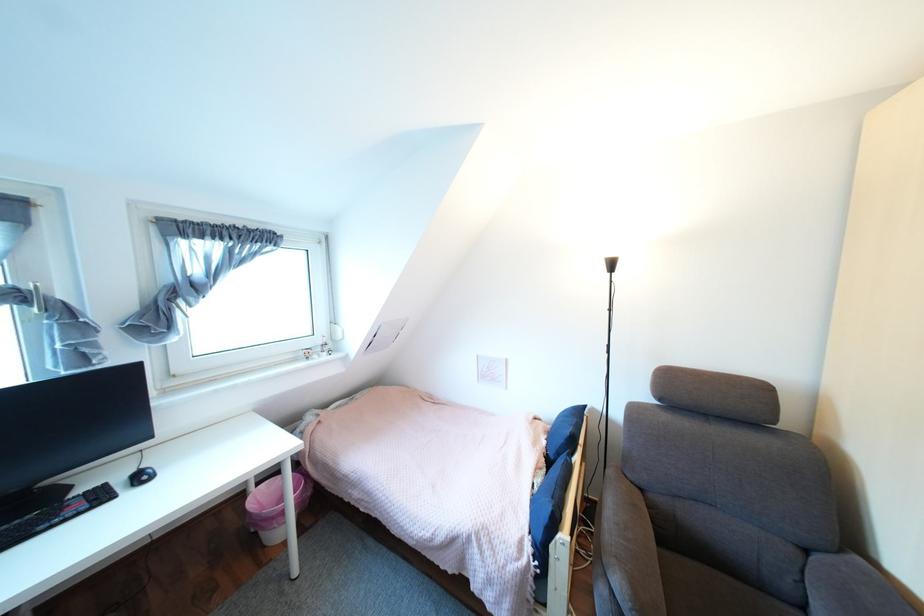
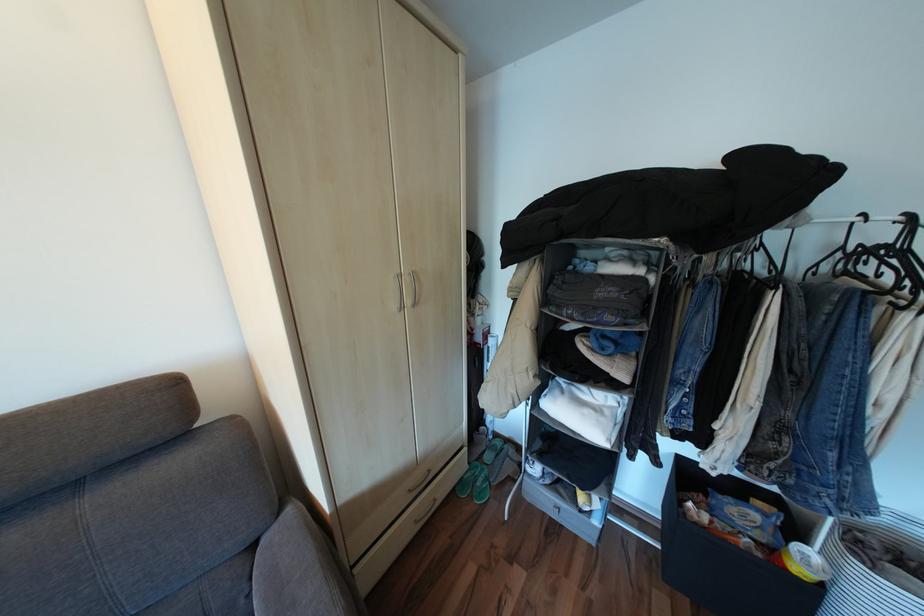
The first image is from the beginning of the video and the second image is from the end. How did the camera likely rotate when shooting the video?

The camera rotated toward right-down.